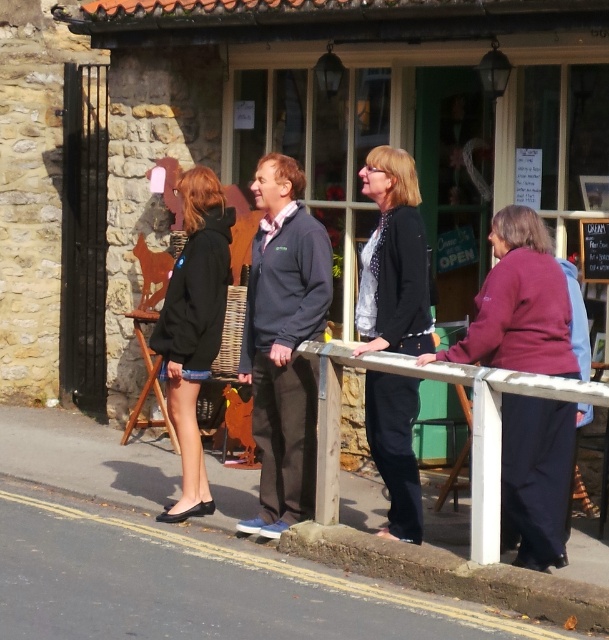
Question: Which point is farther to the camera?

Choices:
 (A) (280, 408)
 (B) (163, 369)
 (C) (533, 307)

Answer: (B)

Question: Is dark blue fleece jacket at center to the right of black fabric jacket at center from the viewer's perspective?

Choices:
 (A) yes
 (B) no

Answer: (B)

Question: Which point is farther to the camera?

Choices:
 (A) black matte jacket at left
 (B) concrete curb at lower center
 (C) black fabric jacket at center
 (D) white wood rail at center

Answer: (A)

Question: Where is purple fleece jacket at center located in relation to black fabric jacket at center in the image?

Choices:
 (A) above
 (B) below

Answer: (B)

Question: Can you confirm if purple fleece jacket at center is positioned below dark blue fleece jacket at center?

Choices:
 (A) no
 (B) yes

Answer: (B)

Question: Considering the real-world distances, which object is farthest from the black matte jacket at left?

Choices:
 (A) black fabric jacket at center
 (B) purple fleece jacket at center
 (C) white wood rail at center

Answer: (B)